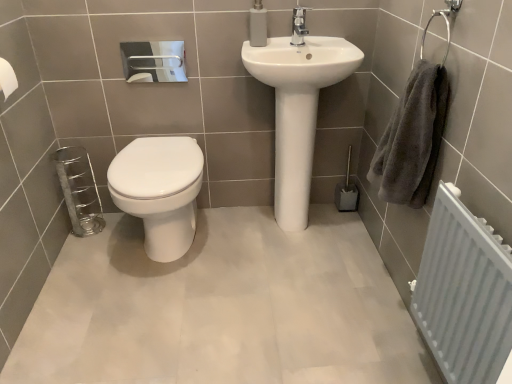
Identify the location of free space that is in between white glossy toilet at center and white glossy sink at center. Image resolution: width=512 pixels, height=384 pixels. (243, 237).